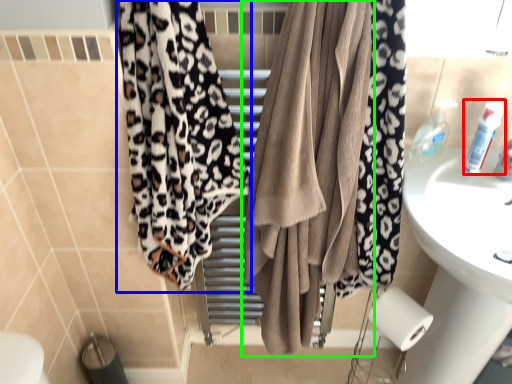
Question: Based on their relative distances, which object is nearer to toiletry (highlighted by a red box)? Choose from curtain (highlighted by a blue box) and curtain (highlighted by a green box).

Choices:
 (A) curtain
 (B) curtain

Answer: (B)